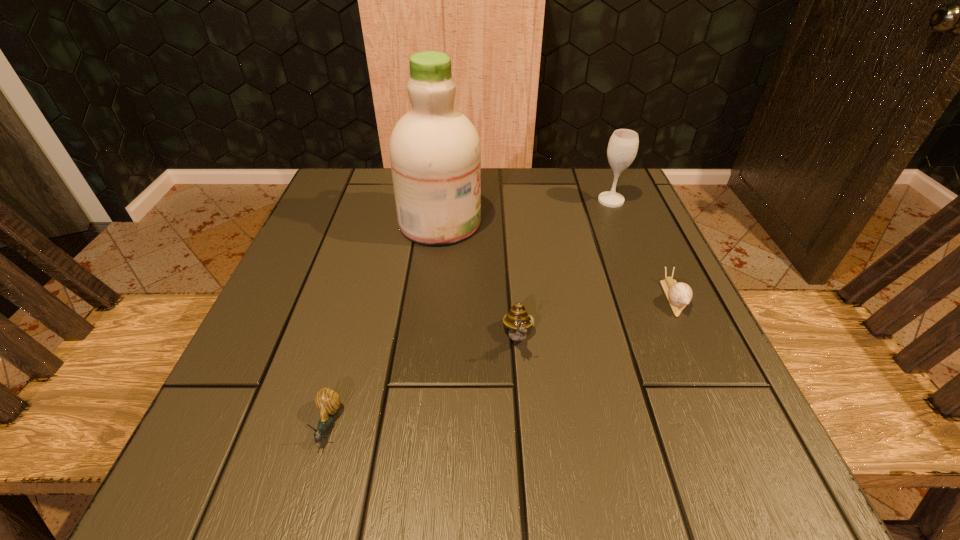
Where is `free point located on the face of the third object from right to left`? The width and height of the screenshot is (960, 540). free point located on the face of the third object from right to left is located at coordinates (524, 401).

Where is `vacant space positioned on the front-facing side of the nearest object`? vacant space positioned on the front-facing side of the nearest object is located at coordinates (309, 492).

Locate an element on the screen. Image resolution: width=960 pixels, height=540 pixels. free spot located on the shell of the rightmost escargot is located at coordinates (712, 382).

Where is `cleansing agent positioned at the far edge`? This screenshot has height=540, width=960. cleansing agent positioned at the far edge is located at coordinates (435, 152).

Identify the location of wineglass that is at the far edge. This screenshot has height=540, width=960. (623, 145).

The width and height of the screenshot is (960, 540). Identify the location of object that is at the near edge. (327, 401).

The width and height of the screenshot is (960, 540). Identify the location of object present at the left edge. (327, 401).

The image size is (960, 540). Find the location of `wineglass positioned at the right edge`. wineglass positioned at the right edge is located at coordinates (623, 145).

Locate an element on the screen. The height and width of the screenshot is (540, 960). escargot situated at the right edge is located at coordinates (679, 295).

Where is `object that is at the near left corner`? object that is at the near left corner is located at coordinates (327, 401).